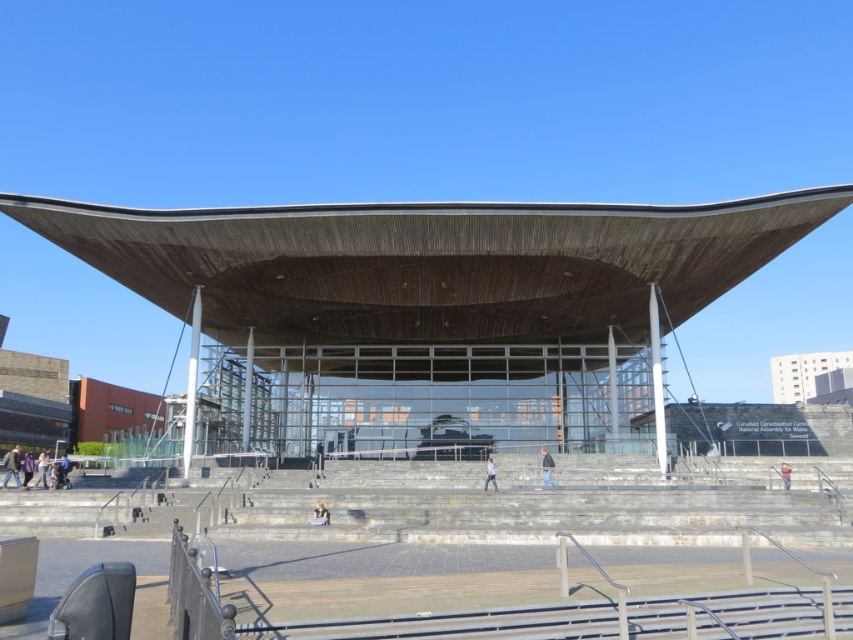
Is point (543, 476) farther from viewer compared to point (486, 465)?

No, it is not.

Is gray fabric jacket at center shorter than light gray concrete person at center?

Yes, gray fabric jacket at center is shorter than light gray concrete person at center.

Find the location of a particular element. This screenshot has width=853, height=640. gray fabric jacket at center is located at coordinates (547, 467).

Between wooden canopy at center and light brown leather jacket at center, which one appears on the left side from the viewer's perspective?

light brown leather jacket at center

Find the location of a particular element. wooden canopy at center is located at coordinates (434, 268).

This screenshot has height=640, width=853. Identify the location of wooden canopy at center. (434, 268).

Is point (485, 480) in front of point (787, 467)?

No.

Can you confirm if light gray concrete person at center is smaller than dark gray concrete person at center?

Yes.

Locate an element on the screen. light gray concrete person at center is located at coordinates (490, 476).